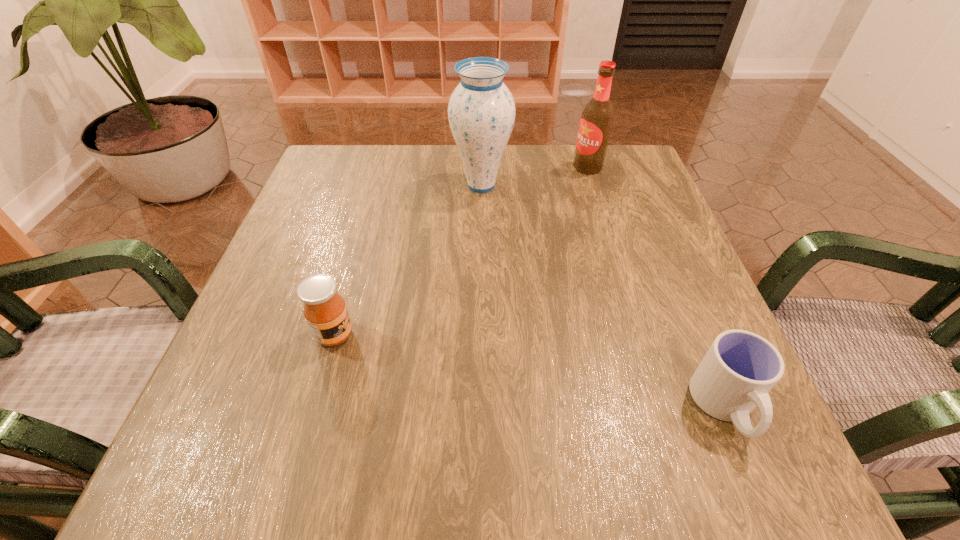
In the image, there is a desktop. Identify the location of vacant space at the far left corner. The image size is (960, 540). click(x=361, y=197).

In the image, there is a desktop. Where is `vacant region at the far right corner`? Image resolution: width=960 pixels, height=540 pixels. vacant region at the far right corner is located at coordinates (627, 179).

This screenshot has height=540, width=960. In the image, there is a desktop. Find the location of `vacant space at the near right corner`. vacant space at the near right corner is located at coordinates (728, 474).

You are a GUI agent. You are given a task and a screenshot of the screen. Output one action in this format:
    pyautogui.click(x=<x>, y=<y>)
    Task: Click on the free spot between the second nearest object and the nearest object
    The image size is (960, 540).
    Given the screenshot: What is the action you would take?
    (530, 371)

Find the location of a particular element. Image resolution: width=960 pixels, height=540 pixels. free space between the honey and the beer bottle is located at coordinates (461, 251).

Locate an element on the screen. empty space that is in between the rightmost object and the second object from right to left is located at coordinates (656, 287).

Locate an element on the screen. The width and height of the screenshot is (960, 540). vacant space that is in between the vase and the second object from right to left is located at coordinates (535, 177).

Where is `free area in between the third object from left to right and the cup`? free area in between the third object from left to right and the cup is located at coordinates (656, 287).

This screenshot has height=540, width=960. What are the coordinates of `vacant point located between the nearest object and the second nearest object` in the screenshot? It's located at (530, 371).

Identify the location of empty space that is in between the third object from left to right and the vase. The width and height of the screenshot is (960, 540). (535, 177).